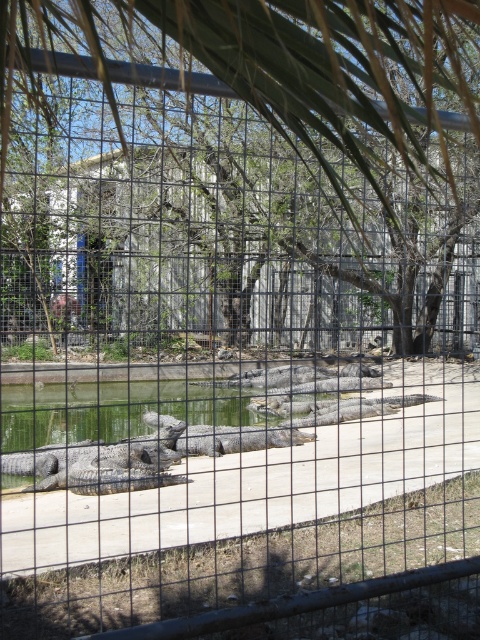
You are standing in front of the metal wire fence at center. Can you see the crocodiles resting on the concrete surface alongside the water through the fence?

Yes, the metal wire fence at center is located at point (x=230, y=490), which is in the foreground, but the crocodiles are in the midground beyond the fence, so they should be visible through the fence.

You are standing in front of the metal fence and notice two points marked on the image. The first point is at coordinates point (321, 93) and the second is at point (309, 404). Which point is nearer to you?

Point (321, 93) is closer to the viewer than point (309, 404).

You are a visitor standing in front of the metal wire fence at center and the gray textured crocodile at center. Which object is closer to your left side?

The gray textured crocodile at center is closer to your left side because the metal wire fence at center is to the right of it.